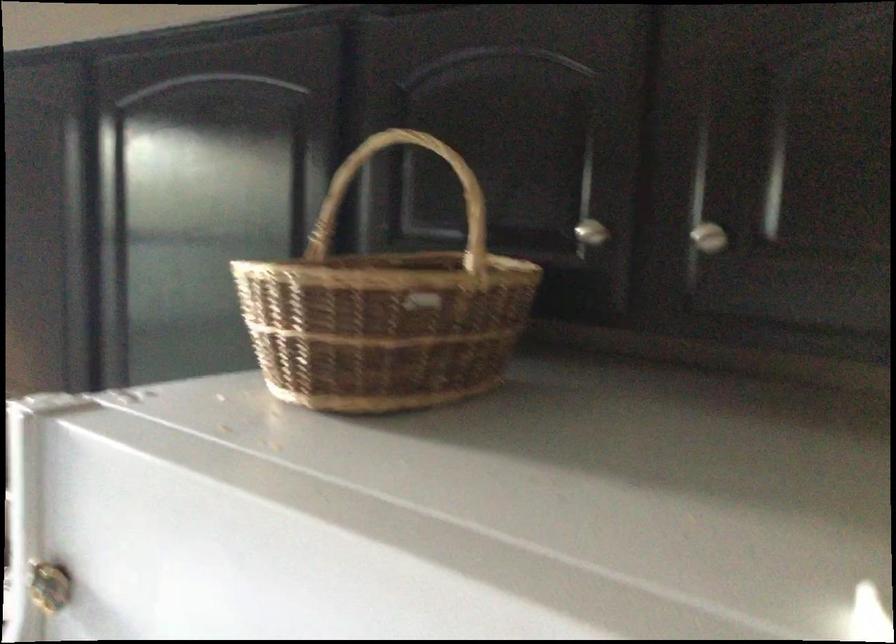
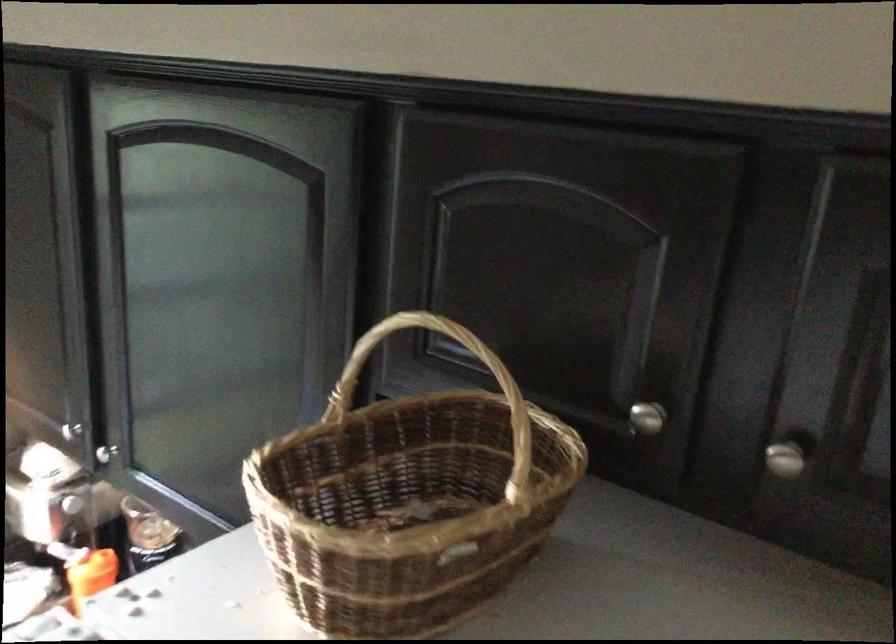
Question: Based on the continuous images, in which direction is the camera rotating? Reply with the corresponding letter.

Choices:
 (A) Left
 (B) Right
 (C) Up
 (D) Down

Answer: (D)